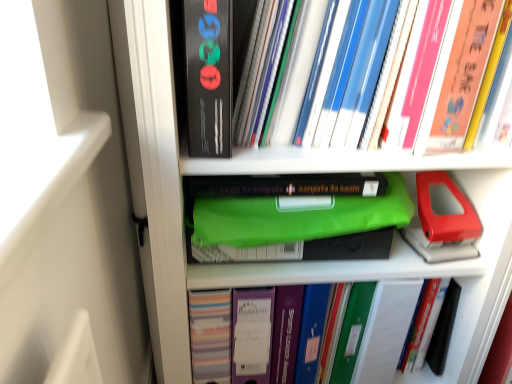
The height and width of the screenshot is (384, 512). Find the location of `matte plastic binder at center, marked as the 1th book in a bottom-to-top arrangement`. matte plastic binder at center, marked as the 1th book in a bottom-to-top arrangement is located at coordinates (x=388, y=325).

Does point (210, 61) appear closer or farther from the camera than point (404, 280)?

Point (210, 61) appears to be closer to the viewer than point (404, 280).

Considering the relative sizes of matte black book at upper center and matte plastic binder at center, marked as the 1th book in a bottom-to-top arrangement, in the image provided, is matte black book at upper center thinner than matte plastic binder at center, marked as the 1th book in a bottom-to-top arrangement,?

In fact, matte black book at upper center might be wider than matte plastic binder at center, marked as the 1th book in a bottom-to-top arrangement.

From a real-world perspective, count 2nd books downward from the matte black book at upper center and point to it. Please provide its 2D coordinates.

[(388, 325)]

Is matte black book at upper center looking in the opposite direction of matte plastic binder at center, marked as the 1th book in a bottom-to-top arrangement?

No.

Consider the image. Is hardcover books at upper right, placed as the 1th book when sorted from top to bottom, to the right of matte plastic binder at center, which ranks as the 2th book in top-to-bottom order, from the viewer's perspective?

Yes.

Based on the photo, in terms of width, does hardcover books at upper right, placed as the 1th book when sorted from top to bottom, look wider or thinner when compared to matte plastic binder at center, which ranks as the 2th book in top-to-bottom order?

hardcover books at upper right, placed as the 1th book when sorted from top to bottom, is wider than matte plastic binder at center, which ranks as the 2th book in top-to-bottom order.

Looking at this image, is hardcover books at upper right, positioned as the second book in bottom-to-top order, oriented towards matte plastic binder at center, marked as the 1th book in a bottom-to-top arrangement?

→ No, hardcover books at upper right, positioned as the second book in bottom-to-top order, is not facing towards matte plastic binder at center, marked as the 1th book in a bottom-to-top arrangement.

Which is in front, point (325, 137) or point (454, 282)?

The point (325, 137) is more forward.

Is matte black book at upper center surrounding hardcover books at upper right, positioned as the second book in bottom-to-top order?

Definitely not — hardcover books at upper right, positioned as the second book in bottom-to-top order, is not inside matte black book at upper center.

Is matte black book at upper center positioned with its back to hardcover books at upper right, placed as the 1th book when sorted from top to bottom?

matte black book at upper center does not have its back to hardcover books at upper right, placed as the 1th book when sorted from top to bottom.

Is matte black book at upper center smaller than hardcover books at upper right, placed as the 1th book when sorted from top to bottom?

Correct, matte black book at upper center occupies less space than hardcover books at upper right, placed as the 1th book when sorted from top to bottom.

Considering the sizes of objects matte black book at upper center and hardcover books at upper right, placed as the 1th book when sorted from top to bottom, in the image provided, who is shorter, matte black book at upper center or hardcover books at upper right, placed as the 1th book when sorted from top to bottom,?

Standing shorter between the two is hardcover books at upper right, placed as the 1th book when sorted from top to bottom.

Could you tell me if matte plastic binder at center, marked as the 1th book in a bottom-to-top arrangement, is facing matte black book at upper center?

No, matte plastic binder at center, marked as the 1th book in a bottom-to-top arrangement, is not turned towards matte black book at upper center.

From the image's perspective, between matte plastic binder at center, marked as the 1th book in a bottom-to-top arrangement, and matte black book at upper center, which one is located above?

matte black book at upper center appears higher in the image.

Considering the positions of objects matte plastic binder at center, marked as the 1th book in a bottom-to-top arrangement, and matte black book at upper center in the image provided, who is more to the left, matte plastic binder at center, marked as the 1th book in a bottom-to-top arrangement, or matte black book at upper center?

From the viewer's perspective, matte black book at upper center appears more on the left side.

Locate an element on the screen. The width and height of the screenshot is (512, 384). paperback book located on the left of matte plastic binder at center, which ranks as the 2th book in top-to-bottom order is located at coordinates (208, 76).

Considering the positions of point (245, 62) and point (219, 131), is point (245, 62) closer or farther from the camera than point (219, 131)?

Point (245, 62) is positioned farther from the camera compared to point (219, 131).

Is hardcover books at upper right, positioned as the second book in bottom-to-top order, next to matte black book at upper center?

No, hardcover books at upper right, positioned as the second book in bottom-to-top order, is not next to matte black book at upper center.

Is hardcover books at upper right, positioned as the second book in bottom-to-top order, looking in the opposite direction of matte black book at upper center?

No.

Between hardcover books at upper right, placed as the 1th book when sorted from top to bottom, and matte black book at upper center, which one has larger size?

With larger size is hardcover books at upper right, placed as the 1th book when sorted from top to bottom.

Which object is wider, matte plastic binder at center, which ranks as the 2th book in top-to-bottom order, or hardcover books at upper right, positioned as the second book in bottom-to-top order?

With larger width is hardcover books at upper right, positioned as the second book in bottom-to-top order.

Considering the relative positions of matte plastic binder at center, marked as the 1th book in a bottom-to-top arrangement, and hardcover books at upper right, placed as the 1th book when sorted from top to bottom, in the image provided, is matte plastic binder at center, marked as the 1th book in a bottom-to-top arrangement, to the right of hardcover books at upper right, placed as the 1th book when sorted from top to bottom, from the viewer's perspective?

Incorrect, matte plastic binder at center, marked as the 1th book in a bottom-to-top arrangement, is not on the right side of hardcover books at upper right, placed as the 1th book when sorted from top to bottom.

From the image's perspective, is matte plastic binder at center, which ranks as the 2th book in top-to-bottom order, located above or below hardcover books at upper right, positioned as the second book in bottom-to-top order?

matte plastic binder at center, which ranks as the 2th book in top-to-bottom order, is situated lower than hardcover books at upper right, positioned as the second book in bottom-to-top order, in the image.

Which is correct: matte plastic binder at center, which ranks as the 2th book in top-to-bottom order, is inside hardcover books at upper right, placed as the 1th book when sorted from top to bottom, or outside of it?

matte plastic binder at center, which ranks as the 2th book in top-to-bottom order, cannot be found inside hardcover books at upper right, placed as the 1th book when sorted from top to bottom.

Starting from the matte black book at upper center, which book is the 2nd one behind? Please provide its 2D coordinates.

[(388, 325)]

Find the location of a particular element. The width and height of the screenshot is (512, 384). book above the matte plastic binder at center, which ranks as the 2th book in top-to-bottom order (from a real-world perspective) is located at coordinates (345, 86).

When comparing their distances from matte black book at upper center, does matte plastic binder at center, marked as the 1th book in a bottom-to-top arrangement, or hardcover books at upper right, placed as the 1th book when sorted from top to bottom, seem further?

The object further to matte black book at upper center is matte plastic binder at center, marked as the 1th book in a bottom-to-top arrangement.

Considering their positions, is matte black book at upper center positioned closer to matte plastic binder at center, marked as the 1th book in a bottom-to-top arrangement, than hardcover books at upper right, positioned as the second book in bottom-to-top order?

hardcover books at upper right, positioned as the second book in bottom-to-top order.

Looking at the image, which one is located closer to matte plastic binder at center, which ranks as the 2th book in top-to-bottom order, hardcover books at upper right, positioned as the second book in bottom-to-top order, or matte black book at upper center?

hardcover books at upper right, positioned as the second book in bottom-to-top order.

From the image, which object appears to be nearer to hardcover books at upper right, placed as the 1th book when sorted from top to bottom, matte black book at upper center or matte plastic binder at center, marked as the 1th book in a bottom-to-top arrangement?

matte black book at upper center lies closer to hardcover books at upper right, placed as the 1th book when sorted from top to bottom, than the other object.

From the image, which object appears to be farther from matte black book at upper center, hardcover books at upper right, positioned as the second book in bottom-to-top order, or matte plastic binder at center, marked as the 1th book in a bottom-to-top arrangement?

matte plastic binder at center, marked as the 1th book in a bottom-to-top arrangement, is positioned further to the anchor matte black book at upper center.

Based on their spatial positions, is matte plastic binder at center, which ranks as the 2th book in top-to-bottom order, or matte black book at upper center closer to hardcover books at upper right, positioned as the second book in bottom-to-top order?

matte black book at upper center is closer to hardcover books at upper right, positioned as the second book in bottom-to-top order.

This screenshot has width=512, height=384. Identify the location of book between matte black book at upper center and matte plastic binder at center, which ranks as the 2th book in top-to-bottom order, vertically. (345, 86).